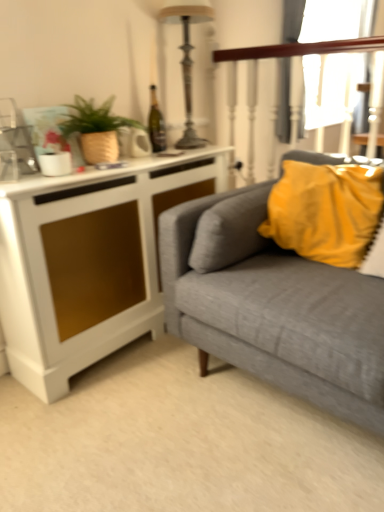
Question: Is point (43, 209) positioned closer to the camera than point (273, 333)?

Choices:
 (A) closer
 (B) farther

Answer: (B)

Question: Is white matte cabinet at left in front of or behind textured gray couch at right in the image?

Choices:
 (A) behind
 (B) front

Answer: (A)

Question: Which object is the closest to the textured gray couch at right?

Choices:
 (A) yellow fabric pillow at upper right
 (B) matte brown pot at upper left
 (C) white matte cabinet at left
 (D) wooden polished rail at upper right
 (E) metallic silver lamp at upper center

Answer: (A)

Question: Which object is the closest to the white matte cabinet at left?

Choices:
 (A) matte brown pot at upper left
 (B) textured gray couch at right
 (C) wooden polished rail at upper right
 (D) metallic silver lamp at upper center
 (E) yellow fabric pillow at upper right

Answer: (A)